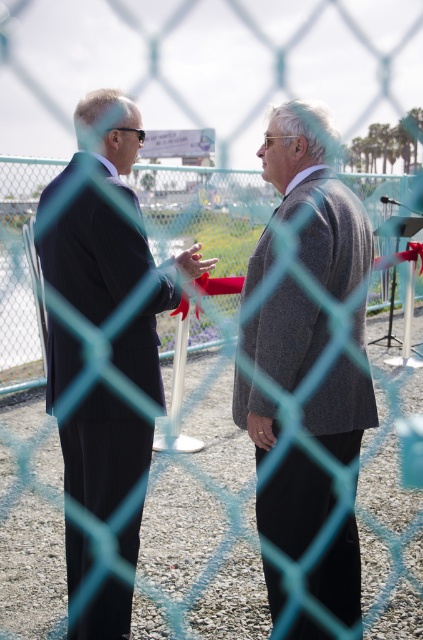
Can you confirm if matte black suit at left is shorter than gray wool suit at center?

No.

Is point (125, 161) positioned before point (335, 438)?

No, (125, 161) is further to viewer.

Identify the location of matte black suit at left. (106, 312).